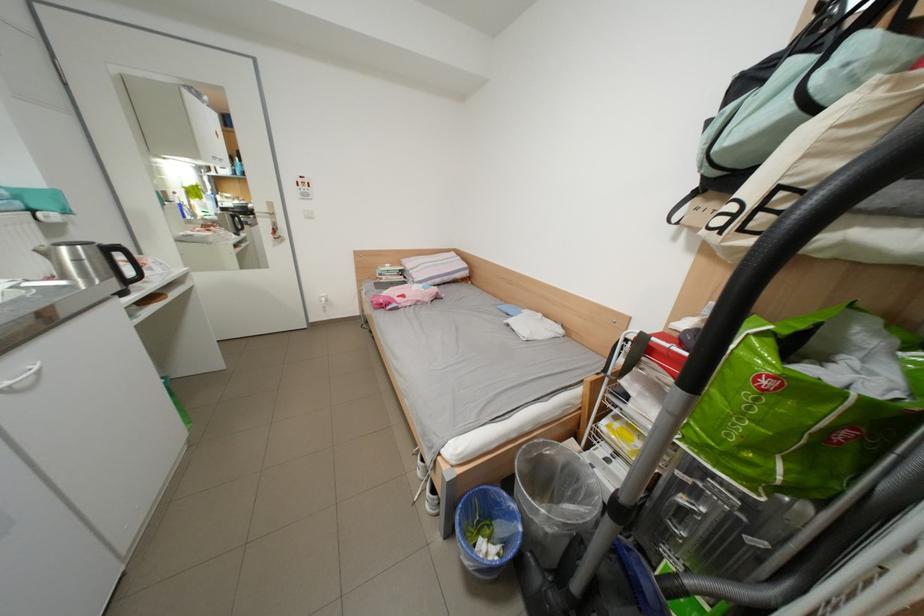
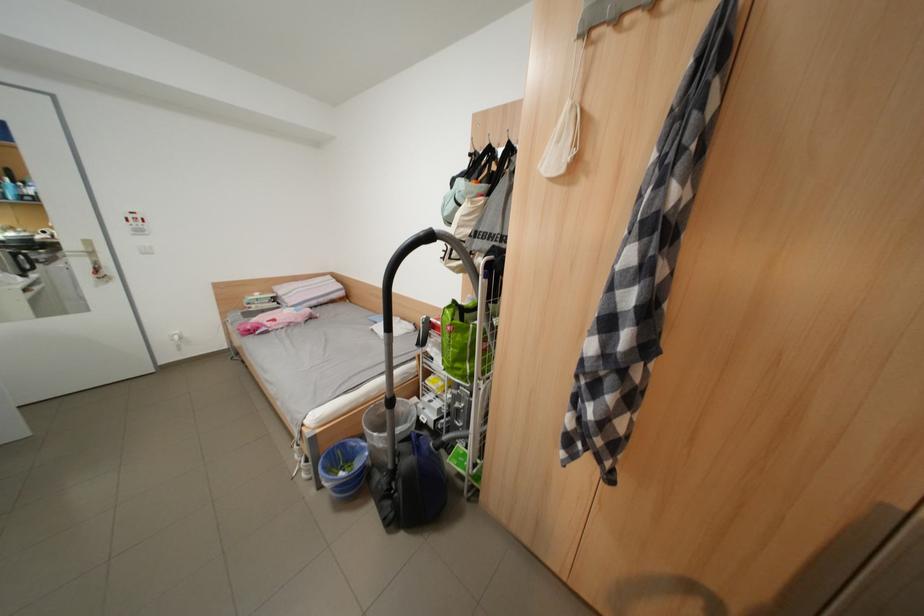
Question: The camera is either moving clockwise (left) or counter-clockwise (right) around the object. The first image is from the beginning of the video and the second image is from the end. Is the camera moving left or right when shooting the video?

Choices:
 (A) Left
 (B) Right

Answer: (A)